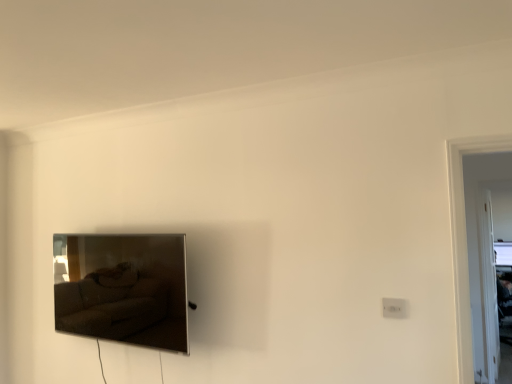
Find the location of a particular element. This screenshot has height=384, width=512. white plastic electric outlet at lower right is located at coordinates (394, 308).

Measure the distance between point (405, 309) and camera.

Point (405, 309) and camera are 1.84 meters apart.

What do you see at coordinates (394, 308) in the screenshot?
I see `white plastic electric outlet at lower right` at bounding box center [394, 308].

Describe the element at coordinates (123, 289) in the screenshot. I see `matte black tv at left` at that location.

Locate an element on the screen. The height and width of the screenshot is (384, 512). matte black tv at left is located at coordinates (123, 289).

In order to face matte black tv at left, should I rotate leftwards or rightwards?

You should rotate left by 17.330 degrees.

Identify the location of white plastic electric outlet at lower right. The image size is (512, 384). (394, 308).

Considering the relative positions of white plastic electric outlet at lower right and matte black tv at left in the image provided, is white plastic electric outlet at lower right to the left of matte black tv at left from the viewer's perspective?

No.

Looking at this image, is white plastic electric outlet at lower right positioned behind matte black tv at left?

No, white plastic electric outlet at lower right is closer to the viewer.

Considering the positions of points (402, 307) and (93, 276), is point (402, 307) farther from camera compared to point (93, 276)?

No.

From the image's perspective, is white plastic electric outlet at lower right positioned above or below matte black tv at left?

Based on their image positions, white plastic electric outlet at lower right is located above matte black tv at left.

From a real-world perspective, who is located higher, white plastic electric outlet at lower right or matte black tv at left?

From a 3D spatial view, matte black tv at left is above.

Between white plastic electric outlet at lower right and matte black tv at left, which one has larger width?

matte black tv at left is wider.

In the scene shown: Who is shorter, white plastic electric outlet at lower right or matte black tv at left?

white plastic electric outlet at lower right.

Considering the sizes of objects white plastic electric outlet at lower right and matte black tv at left in the image provided, who is bigger, white plastic electric outlet at lower right or matte black tv at left?

matte black tv at left.

Is white plastic electric outlet at lower right spatially inside matte black tv at left, or outside of it?

white plastic electric outlet at lower right lies outside matte black tv at left.

Is white plastic electric outlet at lower right directly adjacent to matte black tv at left?

No, white plastic electric outlet at lower right is not in contact with matte black tv at left.

Is white plastic electric outlet at lower right oriented towards matte black tv at left?

No, white plastic electric outlet at lower right does not turn towards matte black tv at left.

What's the angular difference between white plastic electric outlet at lower right and matte black tv at left's facing directions?

There is a 0.0648-degree angle between the facing directions of white plastic electric outlet at lower right and matte black tv at left.

Where is `picture frame that is below the white plastic electric outlet at lower right (from the image's perspective)`? picture frame that is below the white plastic electric outlet at lower right (from the image's perspective) is located at coordinates (123, 289).

Considering the positions of objects matte black tv at left and white plastic electric outlet at lower right in the image provided, who is more to the right, matte black tv at left or white plastic electric outlet at lower right?

white plastic electric outlet at lower right.

Is matte black tv at left in front of or behind white plastic electric outlet at lower right in the image?

Clearly, matte black tv at left is behind white plastic electric outlet at lower right.

Is point (73, 237) positioned after point (396, 303)?

Yes.

From the image's perspective, who appears lower, matte black tv at left or white plastic electric outlet at lower right?

matte black tv at left is shown below in the image.

From a real-world perspective, is matte black tv at left over white plastic electric outlet at lower right?

Indeed, from a real-world perspective, matte black tv at left stands above white plastic electric outlet at lower right.

Is matte black tv at left wider than white plastic electric outlet at lower right?

Indeed, matte black tv at left has a greater width compared to white plastic electric outlet at lower right.

From their relative heights in the image, would you say matte black tv at left is taller or shorter than white plastic electric outlet at lower right?

Considering their sizes, matte black tv at left has more height than white plastic electric outlet at lower right.

Considering the relative sizes of matte black tv at left and white plastic electric outlet at lower right in the image provided, is matte black tv at left smaller than white plastic electric outlet at lower right?

No.

Is white plastic electric outlet at lower right inside matte black tv at left?

Definitely not — white plastic electric outlet at lower right is not inside matte black tv at left.

Are matte black tv at left and white plastic electric outlet at lower right far apart?

Indeed, matte black tv at left is not near white plastic electric outlet at lower right.

Is white plastic electric outlet at lower right at the back of matte black tv at left?

No, matte black tv at left is not facing away from white plastic electric outlet at lower right.

How many degrees apart are the facing directions of matte black tv at left and white plastic electric outlet at lower right?

There is a 0.0648-degree angle between the facing directions of matte black tv at left and white plastic electric outlet at lower right.

Measure the distance from matte black tv at left to white plastic electric outlet at lower right.

matte black tv at left is 1.41 meters away from white plastic electric outlet at lower right.

The width and height of the screenshot is (512, 384). In order to click on picture frame on the left of white plastic electric outlet at lower right in this screenshot , I will do `click(123, 289)`.

You are a GUI agent. You are given a task and a screenshot of the screen. Output one action in this format:
    pyautogui.click(x=<x>, y=<y>)
    Task: Click on the picture frame above the white plastic electric outlet at lower right (from a real-world perspective)
    
    Given the screenshot: What is the action you would take?
    pyautogui.click(x=123, y=289)

Find the location of a particular element. The width and height of the screenshot is (512, 384). picture frame located below the white plastic electric outlet at lower right (from the image's perspective) is located at coordinates (123, 289).